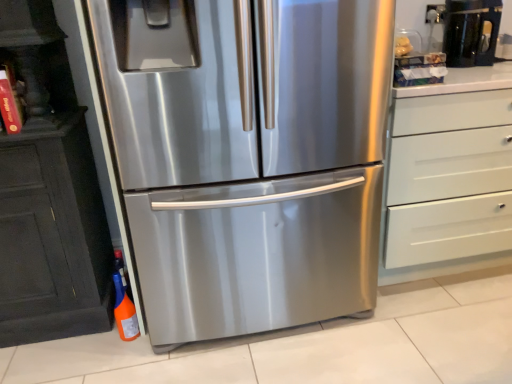
This screenshot has width=512, height=384. I want to click on orange matte bottle at lower left, so click(124, 302).

Image resolution: width=512 pixels, height=384 pixels. Describe the element at coordinates (447, 182) in the screenshot. I see `white matte chest of drawers at right` at that location.

The width and height of the screenshot is (512, 384). What do you see at coordinates (468, 30) in the screenshot? I see `black glossy coffee machine at upper right` at bounding box center [468, 30].

The image size is (512, 384). In order to click on black glossy coffee machine at upper right in this screenshot , I will do `click(468, 30)`.

This screenshot has width=512, height=384. I want to click on orange matte bottle at lower left, so click(x=124, y=302).

Which object is further away from the camera taking this photo, stainless steel refrigerator at center or black glossy coffee machine at upper right?

black glossy coffee machine at upper right is behind.

Which point is more forward, (368,147) or (481,0)?

Positioned in front is point (368,147).

Considering the relative sizes of stainless steel refrigerator at center and black glossy coffee machine at upper right in the image provided, is stainless steel refrigerator at center thinner than black glossy coffee machine at upper right?

Incorrect, the width of stainless steel refrigerator at center is not less than that of black glossy coffee machine at upper right.

Are black glossy coffee machine at upper right and white matte chest of drawers at right making contact?

No.

How different are the orientations of black glossy coffee machine at upper right and white matte chest of drawers at right in degrees?

1.09 degrees separate the facing orientations of black glossy coffee machine at upper right and white matte chest of drawers at right.

Which is correct: black glossy coffee machine at upper right is inside white matte chest of drawers at right, or outside of it?

black glossy coffee machine at upper right is not inside white matte chest of drawers at right, it's outside.

Considering the positions of points (492, 50) and (398, 228), is point (492, 50) farther from camera compared to point (398, 228)?

Yes, point (492, 50) is farther from viewer.

Between orange matte bottle at lower left and white matte chest of drawers at right, which one has smaller width?

orange matte bottle at lower left.

Is orange matte bottle at lower left smaller than white matte chest of drawers at right?

Indeed, orange matte bottle at lower left has a smaller size compared to white matte chest of drawers at right.

Considering their positions, is orange matte bottle at lower left located in front of or behind white matte chest of drawers at right?

orange matte bottle at lower left is positioned farther from the viewer than white matte chest of drawers at right.

Is white matte chest of drawers at right spatially inside stainless steel refrigerator at center, or outside of it?

white matte chest of drawers at right is spatially situated outside stainless steel refrigerator at center.

Which is nearer, (435,172) or (261,162)?

Point (435,172) is positioned farther from the camera compared to point (261,162).

Is white matte chest of drawers at right thinner than stainless steel refrigerator at center?

A: Yes.

What's the angular difference between white matte chest of drawers at right and orange matte bottle at lower left's facing directions?

There is a 0.829-degree angle between the facing directions of white matte chest of drawers at right and orange matte bottle at lower left.

Can we say white matte chest of drawers at right lies outside orange matte bottle at lower left?

white matte chest of drawers at right is positioned outside orange matte bottle at lower left.

Is the depth of white matte chest of drawers at right less than that of orange matte bottle at lower left?

Yes, it is in front of orange matte bottle at lower left.

From a real-world perspective, is white matte chest of drawers at right under orange matte bottle at lower left?

Incorrect, from a real-world perspective, white matte chest of drawers at right is higher than orange matte bottle at lower left.

From a real-world perspective, which object rests below the other?

stainless steel refrigerator at center, from a real-world perspective.

Does black glossy coffee machine at upper right turn towards stainless steel refrigerator at center?

No, black glossy coffee machine at upper right is not turned towards stainless steel refrigerator at center.

From the image's perspective, is black glossy coffee machine at upper right located above stainless steel refrigerator at center?

Indeed, from the image's perspective, black glossy coffee machine at upper right is shown above stainless steel refrigerator at center.

Does orange matte bottle at lower left lie in front of black glossy coffee machine at upper right?

Yes, orange matte bottle at lower left is in front of black glossy coffee machine at upper right.

From a real-world perspective, is orange matte bottle at lower left on black glossy coffee machine at upper right?

No, from a real-world perspective, orange matte bottle at lower left is not on top of black glossy coffee machine at upper right.

Looking at this image, is orange matte bottle at lower left turned away from black glossy coffee machine at upper right?

orange matte bottle at lower left is not turned away from black glossy coffee machine at upper right.

Is orange matte bottle at lower left at the right side of black glossy coffee machine at upper right?

No.

The image size is (512, 384). I want to click on refrigerator lying on the left of black glossy coffee machine at upper right, so [248, 157].

I want to click on coffee machine behind the white matte chest of drawers at right, so click(x=468, y=30).

Based on their spatial positions, is white matte chest of drawers at right or black glossy coffee machine at upper right further from orange matte bottle at lower left?

Based on the image, black glossy coffee machine at upper right appears to be further to orange matte bottle at lower left.

When comparing their distances from orange matte bottle at lower left, does stainless steel refrigerator at center or black glossy coffee machine at upper right seem closer?

stainless steel refrigerator at center.

In the scene shown: Estimate the real-world distances between objects in this image. Which object is further from white matte chest of drawers at right, stainless steel refrigerator at center or orange matte bottle at lower left?

Among the two, orange matte bottle at lower left is located further to white matte chest of drawers at right.

Based on their spatial positions, is orange matte bottle at lower left or stainless steel refrigerator at center further from black glossy coffee machine at upper right?

Among the two, orange matte bottle at lower left is located further to black glossy coffee machine at upper right.

When comparing their distances from white matte chest of drawers at right, does black glossy coffee machine at upper right or orange matte bottle at lower left seem closer?

black glossy coffee machine at upper right lies closer to white matte chest of drawers at right than the other object.

Which object lies further to the anchor point black glossy coffee machine at upper right, stainless steel refrigerator at center or orange matte bottle at lower left?

Based on the image, orange matte bottle at lower left appears to be further to black glossy coffee machine at upper right.

When comparing their distances from stainless steel refrigerator at center, does white matte chest of drawers at right or black glossy coffee machine at upper right seem further?

Among the two, black glossy coffee machine at upper right is located further to stainless steel refrigerator at center.

From the image, which object appears to be farther from stainless steel refrigerator at center, black glossy coffee machine at upper right or orange matte bottle at lower left?

black glossy coffee machine at upper right.

Image resolution: width=512 pixels, height=384 pixels. Identify the location of refrigerator between orange matte bottle at lower left and black glossy coffee machine at upper right from left to right. (248, 157).

Image resolution: width=512 pixels, height=384 pixels. In order to click on coffee machine between orange matte bottle at lower left and white matte chest of drawers at right from left to right in this screenshot , I will do `click(468, 30)`.

Find the location of a particular element. refrigerator between orange matte bottle at lower left and white matte chest of drawers at right is located at coordinates (248, 157).

Where is `coffee machine located between stainless steel refrigerator at center and white matte chest of drawers at right in the left-right direction`? This screenshot has height=384, width=512. coffee machine located between stainless steel refrigerator at center and white matte chest of drawers at right in the left-right direction is located at coordinates (468, 30).